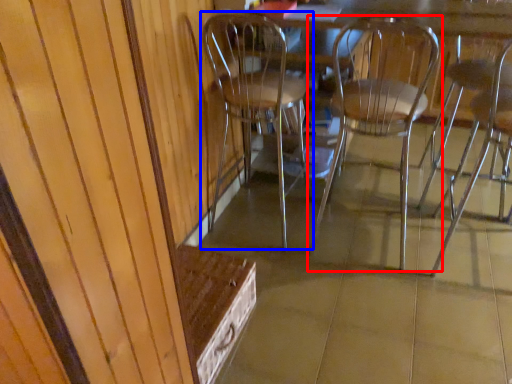
Question: Which of the following is the farthest to the observer, chair (highlighted by a red box) or chair (highlighted by a blue box)?

Choices:
 (A) chair
 (B) chair

Answer: (B)